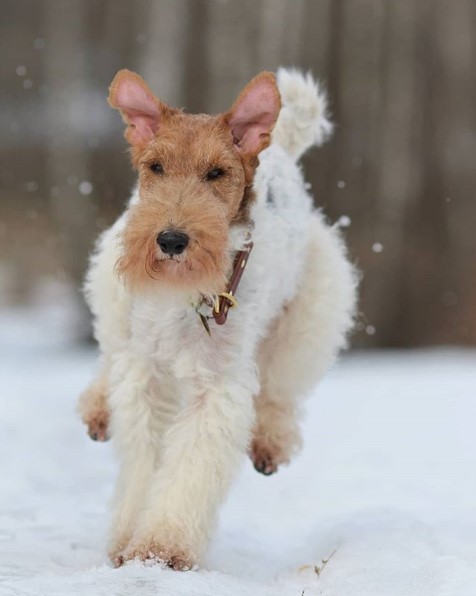
Image resolution: width=476 pixels, height=596 pixels. I want to click on white fur, so click(136, 361), click(234, 361), click(200, 461), click(134, 447), click(315, 332), click(263, 243), click(302, 131).